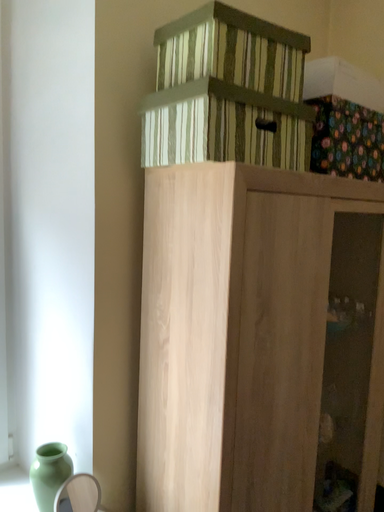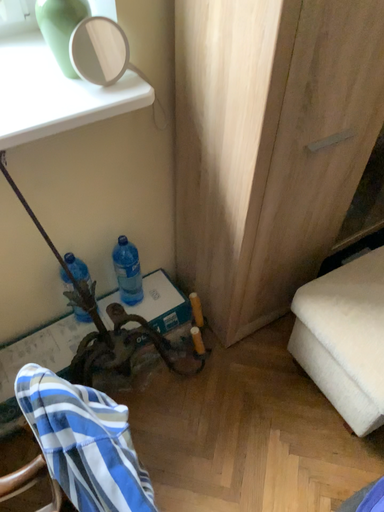
Question: How did the camera likely rotate when shooting the video?

Choices:
 (A) rotated upward
 (B) rotated downward

Answer: (B)